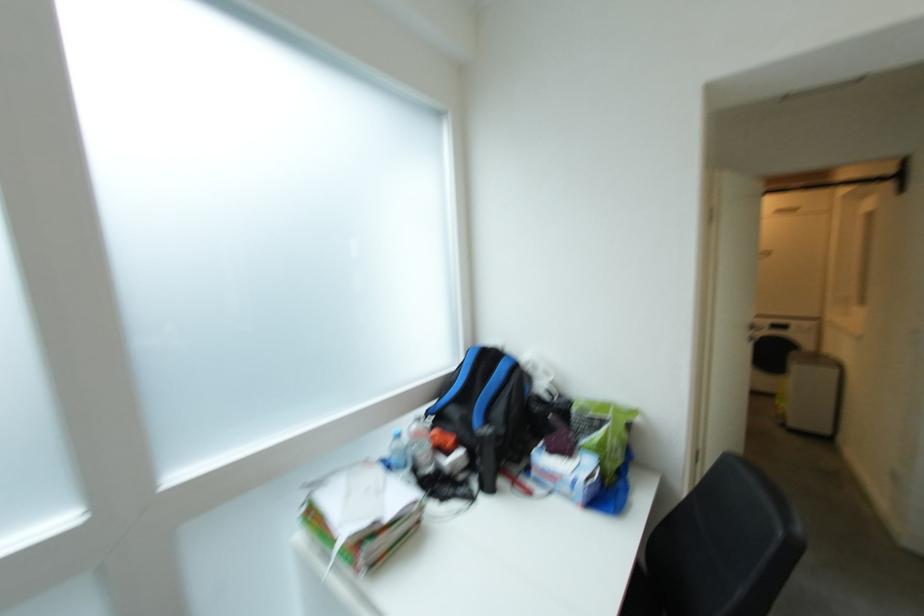
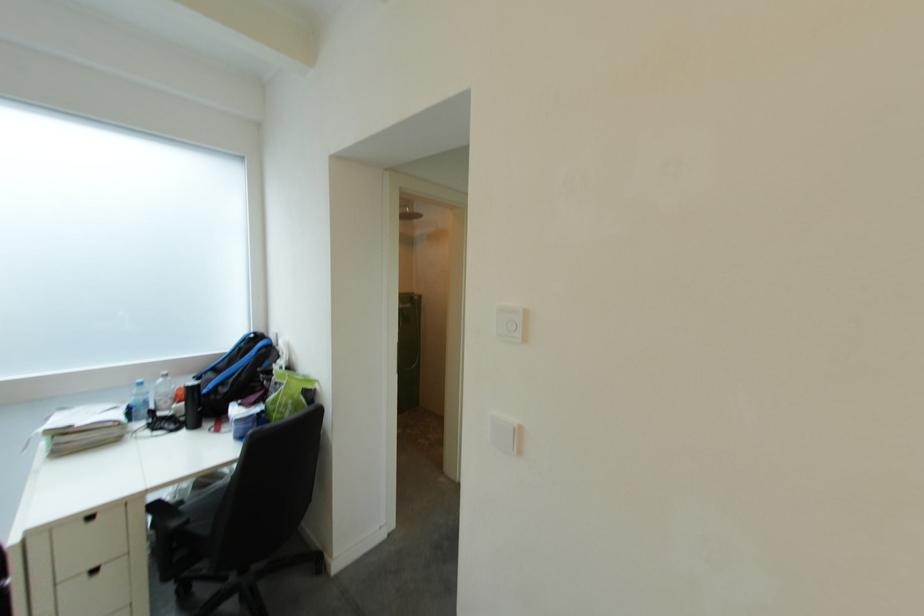
Question: The images are taken continuously from a first-person perspective. In which direction are you moving?

Choices:
 (A) Left
 (B) Right
 (C) Forward
 (D) Backward

Answer: (B)